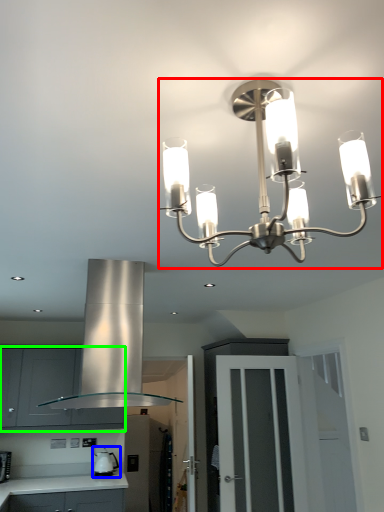
Question: Based on their relative distances, which object is nearer to lamp (highlighted by a red box)? Choose from appliance (highlighted by a blue box) and cabinetry (highlighted by a green box).

Choices:
 (A) appliance
 (B) cabinetry

Answer: (B)